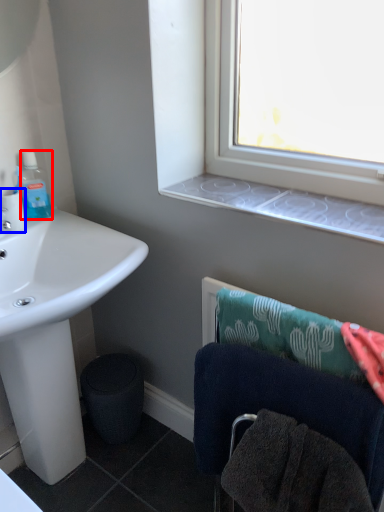
Question: Which object is further to the camera taking this photo, bottle (highlighted by a red box) or coffee cup (highlighted by a blue box)?

Choices:
 (A) bottle
 (B) coffee cup

Answer: (A)